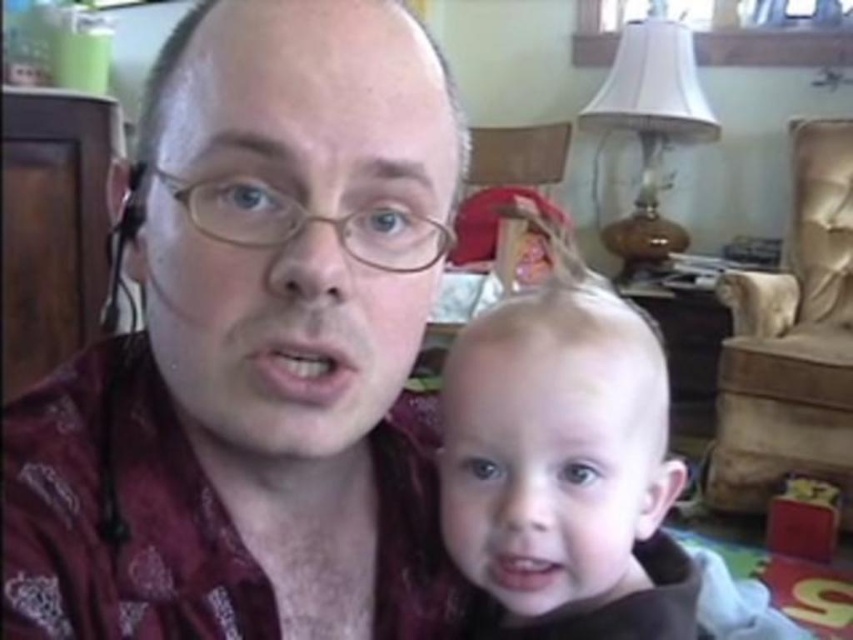
Question: Which point is farther from the camera taking this photo?

Choices:
 (A) (258, 109)
 (B) (549, 592)

Answer: (B)

Question: Is maroon patterned shirt at center to the right of blonde hair at center from the viewer's perspective?

Choices:
 (A) yes
 (B) no

Answer: (B)

Question: Can you confirm if maroon patterned shirt at center is bigger than blonde hair at center?

Choices:
 (A) no
 (B) yes

Answer: (A)

Question: Which point is farther to the camera?

Choices:
 (A) maroon patterned shirt at center
 (B) blonde hair at center

Answer: (B)

Question: Is maroon patterned shirt at center smaller than blonde hair at center?

Choices:
 (A) no
 (B) yes

Answer: (B)

Question: Among these points, which one is nearest to the camera?

Choices:
 (A) (308, 227)
 (B) (548, 481)

Answer: (A)